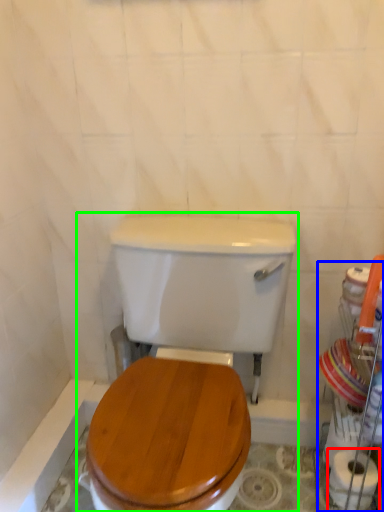
Question: Estimate the real-world distances between objects in this image. Which object is farther from toilet paper (highlighted by a red box), porcelain (highlighted by a blue box) or toilet (highlighted by a green box)?

Choices:
 (A) porcelain
 (B) toilet

Answer: (B)